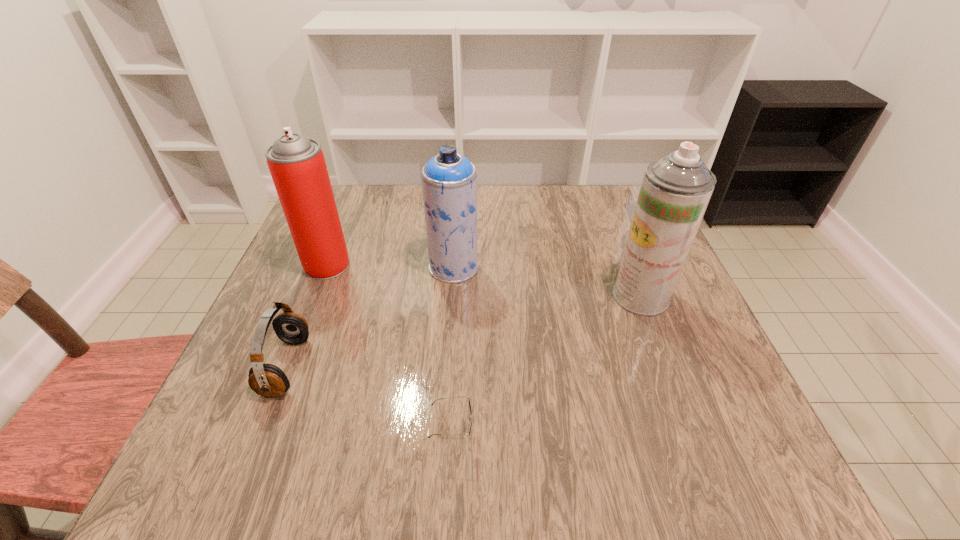
Where is `vacant point located between the headset and the shortest object`? vacant point located between the headset and the shortest object is located at coordinates (370, 401).

Where is `free space between the sunglasses and the second aerosol can from left to right`? free space between the sunglasses and the second aerosol can from left to right is located at coordinates (453, 351).

This screenshot has width=960, height=540. I want to click on free spot between the leftmost aerosol can and the rightmost aerosol can, so 484,281.

I want to click on vacant space that's between the second aerosol can from left to right and the headset, so click(371, 317).

At what (x,y) coordinates should I click in order to perform the action: click on empty location between the second aerosol can from left to right and the second shortest object. Please return your answer as a coordinate pair (x, y). Looking at the image, I should click on (371, 317).

Find the location of a particular element. The height and width of the screenshot is (540, 960). free space between the second aerosol can from right to left and the rightmost object is located at coordinates (547, 281).

Locate an element on the screen. free point between the headset and the second aerosol can from right to left is located at coordinates (371, 317).

Find the location of a particular element. This screenshot has width=960, height=540. free space between the sunglasses and the second aerosol can from right to left is located at coordinates (453, 351).

Find the location of a particular element. Image resolution: width=960 pixels, height=540 pixels. free space between the rightmost object and the shortest object is located at coordinates (547, 366).

Image resolution: width=960 pixels, height=540 pixels. In order to click on free space between the second aerosol can from left to right and the sunglasses in this screenshot , I will do `click(453, 351)`.